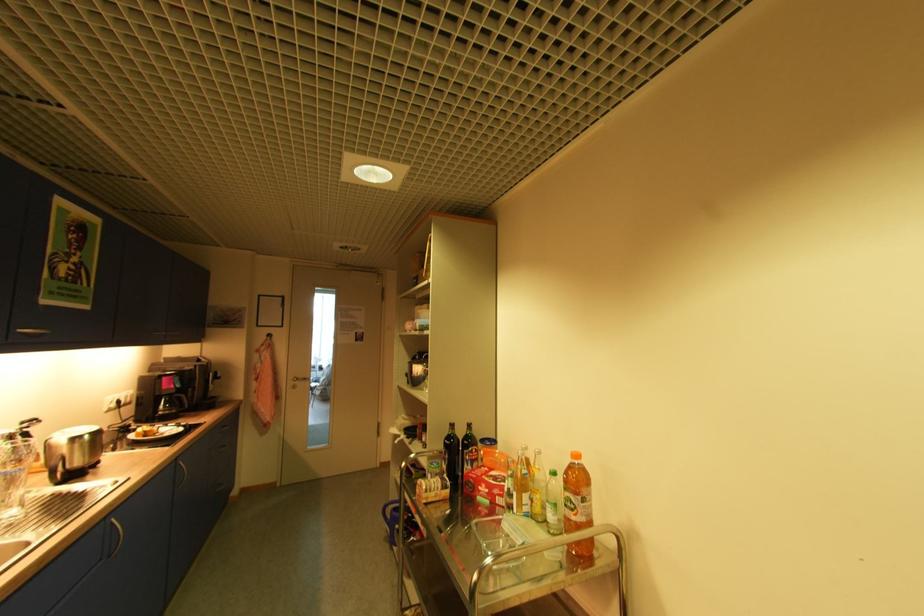
The width and height of the screenshot is (924, 616). I want to click on silver door handle, so click(180, 474).